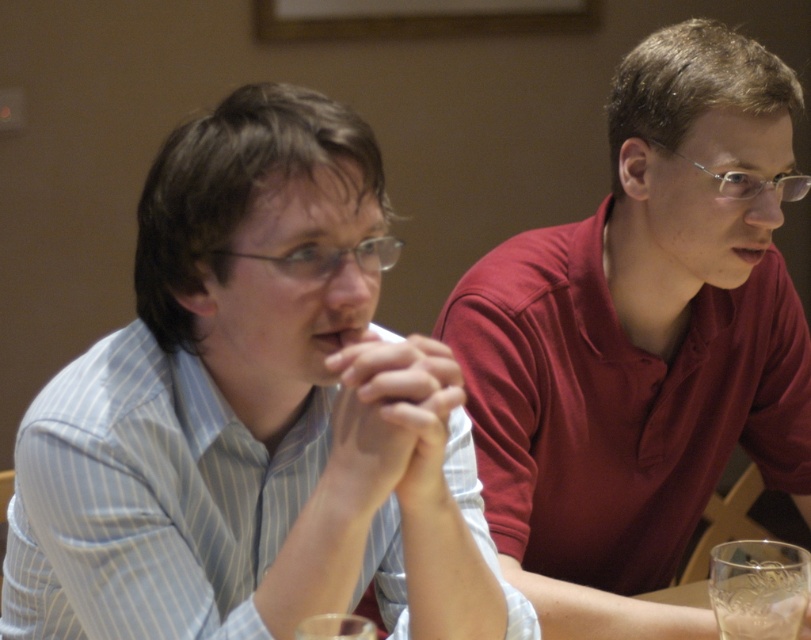
You are a photographer trying to capture a candid shot of the matte red shirt at center without the transparent glass at lower right appearing in the frame. Is this possible based on their positions?

The transparent glass at lower right is behind the matte red shirt at center, so it should not appear in the frame if the photographer focuses on the matte red shirt at center directly.